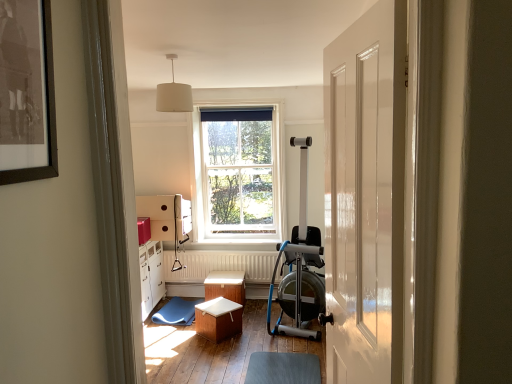
Question: In terms of height, does wooden stool at center, the second stool when ordered from back to front, look taller or shorter compared to white fabric lampshade at upper center?

Choices:
 (A) short
 (B) tall

Answer: (A)

Question: Would you say wooden stool at center, the second stool when ordered from back to front, is inside or outside white fabric lampshade at upper center?

Choices:
 (A) inside
 (B) outside

Answer: (B)

Question: Which object is positioned closest to the wooden box at center?

Choices:
 (A) blue rubber mat at center
 (B) wooden stool at center, which is counted as the 1th stool, starting from the back
 (C) white fabric lampshade at upper center
 (D) white wooden window at center
 (E) white textured radiator at center

Answer: (A)

Question: Considering the real-world distances, which object is closest to the wooden box at center?

Choices:
 (A) silver metallic rowing machine at center
 (B) blue rubber mat at center
 (C) wooden stool at center, which is counted as the 1th stool, starting from the back
 (D) gray rubber footrest at lower center
 (E) white textured radiator at center

Answer: (D)